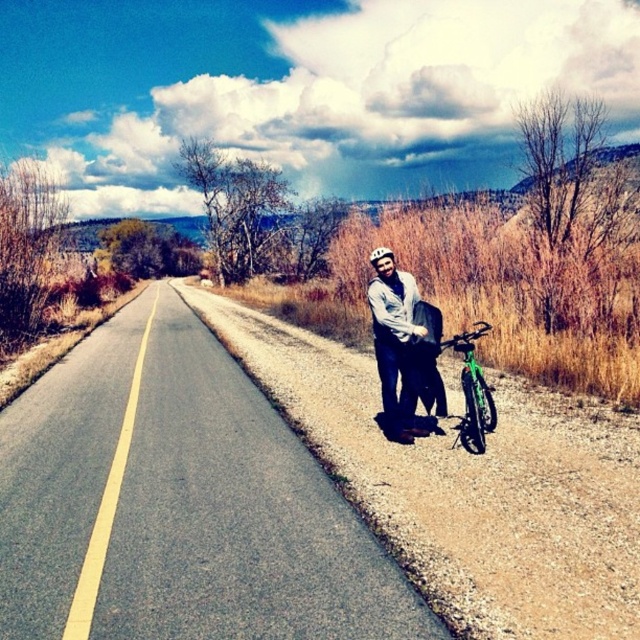
What do you see at coordinates (396, 348) in the screenshot? This screenshot has height=640, width=640. I see `matte gray helmet at right` at bounding box center [396, 348].

Does matte gray helmet at right appear under white matte bicycle helmet at center?

Yes, matte gray helmet at right is below white matte bicycle helmet at center.

Who is more forward, (385,356) or (384,257)?

Point (384,257) is in front.

Find the location of `matte gray helmet at right`. matte gray helmet at right is located at coordinates (396, 348).

The image size is (640, 640). Identify the location of green matte bicycle at right. (472, 392).

Does point (483, 401) lie behind point (385, 253)?

That is True.

Identify the location of green matte bicycle at right. (472, 392).

This screenshot has height=640, width=640. In order to click on green matte bicycle at right in this screenshot , I will do pos(472,392).

Is matte gray helmet at right in front of green matte bicycle at right?

Yes, matte gray helmet at right is closer to the viewer.

Can you confirm if matte gray helmet at right is smaller than green matte bicycle at right?

No, matte gray helmet at right is not smaller than green matte bicycle at right.

Is point (406, 429) in front of point (440, 344)?

No.

Locate an element on the screen. Image resolution: width=640 pixels, height=640 pixels. matte gray helmet at right is located at coordinates (396, 348).